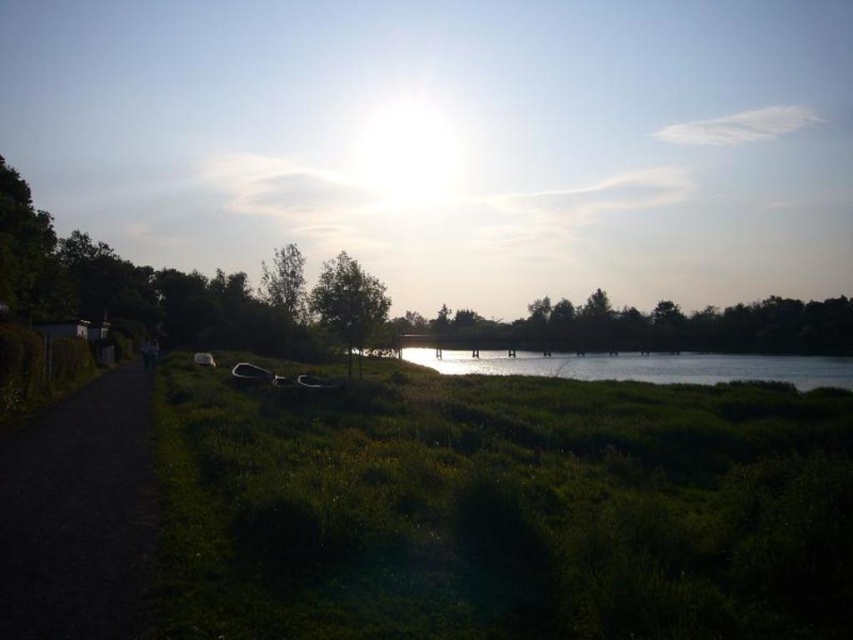
Question: Among these points, which one is nearest to the camera?

Choices:
 (A) (758, 378)
 (B) (273, 273)
 (C) (850, 317)

Answer: (A)

Question: Is green leafy trees at center positioned before green leafy tree at center?

Choices:
 (A) no
 (B) yes

Answer: (A)

Question: Is green matte grass at center bigger than green leafy tree at upper center?

Choices:
 (A) no
 (B) yes

Answer: (A)

Question: Which of the following is the farthest from the observer?

Choices:
 (A) (288, 292)
 (B) (131, 531)

Answer: (A)

Question: Can you confirm if green matte grass at center is thinner than dark asphalt path at left?

Choices:
 (A) yes
 (B) no

Answer: (B)

Question: Which point is closer to the camera?

Choices:
 (A) green matte grass at center
 (B) dark asphalt path at left
 (C) green leafy trees at center
 (D) green leafy tree at center

Answer: (B)